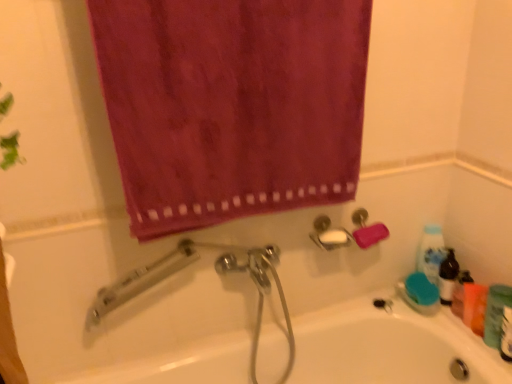
Where is `free location to the left of green plastic mouthwash at lower right, which appears as the second mouthwash when viewed from the left`? The image size is (512, 384). free location to the left of green plastic mouthwash at lower right, which appears as the second mouthwash when viewed from the left is located at coordinates (477, 356).